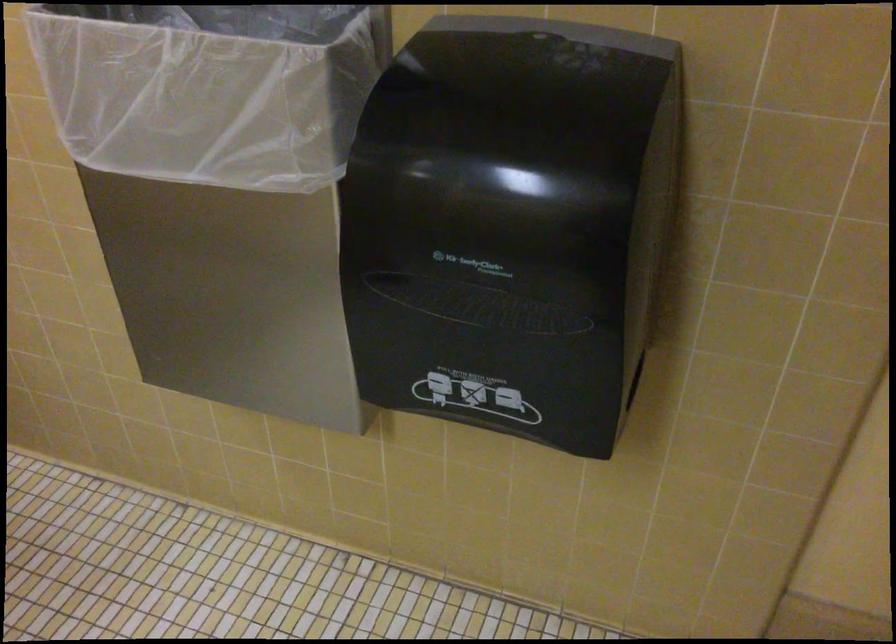
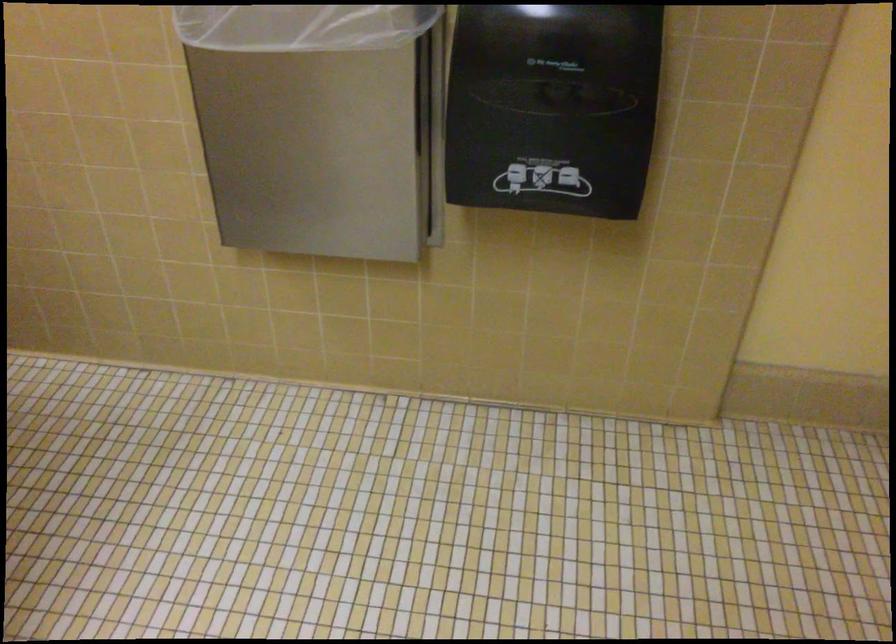
Where in the second image is the point corresponding to (200,154) from the first image?

(300, 26)